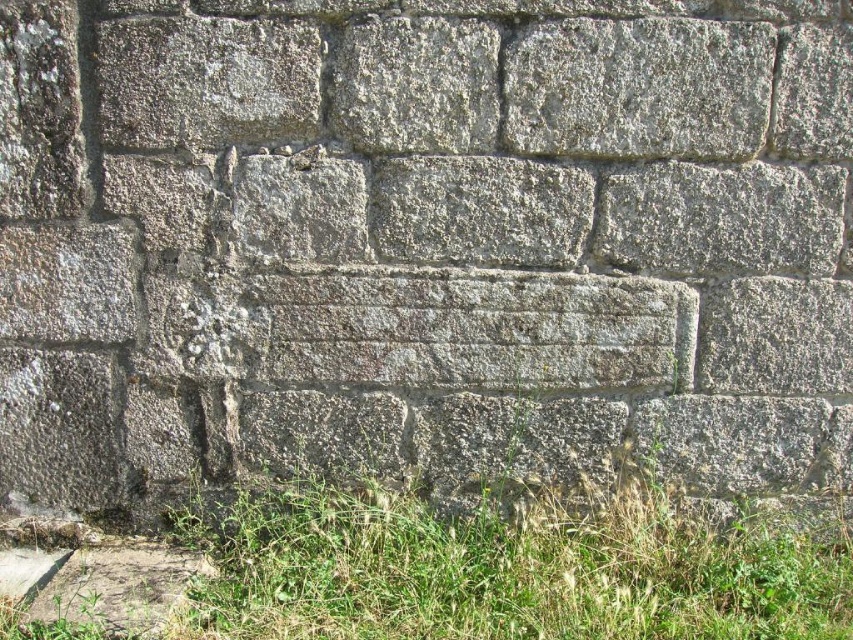
Question: Can you confirm if green grass at lower left is positioned to the left of gray rough stone at upper center?

Choices:
 (A) no
 (B) yes

Answer: (B)

Question: Does green grass at lower left have a lesser width compared to gray rough stone at upper center?

Choices:
 (A) yes
 (B) no

Answer: (B)

Question: Which point is farther to the camera?

Choices:
 (A) gray rough stone at upper center
 (B) green grass at lower left

Answer: (A)

Question: Which object appears farthest from the camera in this image?

Choices:
 (A) green grass at lower left
 (B) gray rough stone at upper center

Answer: (B)

Question: Which point is farther from the camera taking this photo?

Choices:
 (A) (624, 33)
 (B) (500, 564)

Answer: (B)

Question: Is green grass at lower left below gray rough stone at upper center?

Choices:
 (A) no
 (B) yes

Answer: (B)